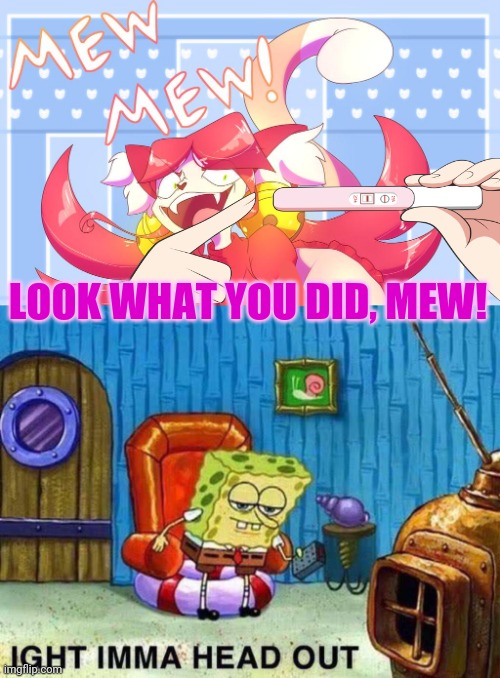
Find the location of a particular element. The image size is (500, 678). chair is located at coordinates (179, 578).